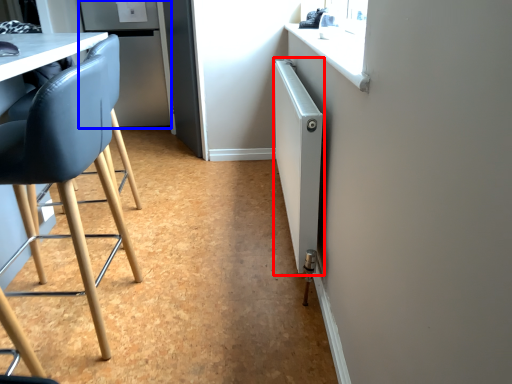
Question: Which of the following is the closest to the observer, radiator (highlighted by a red box) or fridge (highlighted by a blue box)?

Choices:
 (A) radiator
 (B) fridge

Answer: (A)